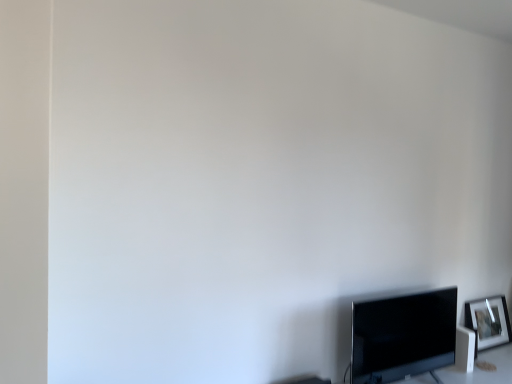
Question: Is matte black tv at lower right taller or shorter than silver metallic picture frame at lower right?

Choices:
 (A) tall
 (B) short

Answer: (A)

Question: Considering the positions of point (418, 294) and point (487, 327), is point (418, 294) closer or farther from the camera than point (487, 327)?

Choices:
 (A) closer
 (B) farther

Answer: (A)

Question: From the image's perspective, is matte black tv at lower right located above or below silver metallic picture frame at lower right?

Choices:
 (A) above
 (B) below

Answer: (A)

Question: Considering the positions of silver metallic picture frame at lower right and matte black tv at lower right in the image, is silver metallic picture frame at lower right taller or shorter than matte black tv at lower right?

Choices:
 (A) tall
 (B) short

Answer: (B)

Question: Is silver metallic picture frame at lower right wider or thinner than matte black tv at lower right?

Choices:
 (A) thin
 (B) wide

Answer: (A)

Question: From a real-world perspective, is silver metallic picture frame at lower right physically located above or below matte black tv at lower right?

Choices:
 (A) above
 (B) below

Answer: (B)

Question: Considering the positions of point (490, 314) and point (373, 302), is point (490, 314) closer or farther from the camera than point (373, 302)?

Choices:
 (A) closer
 (B) farther

Answer: (B)